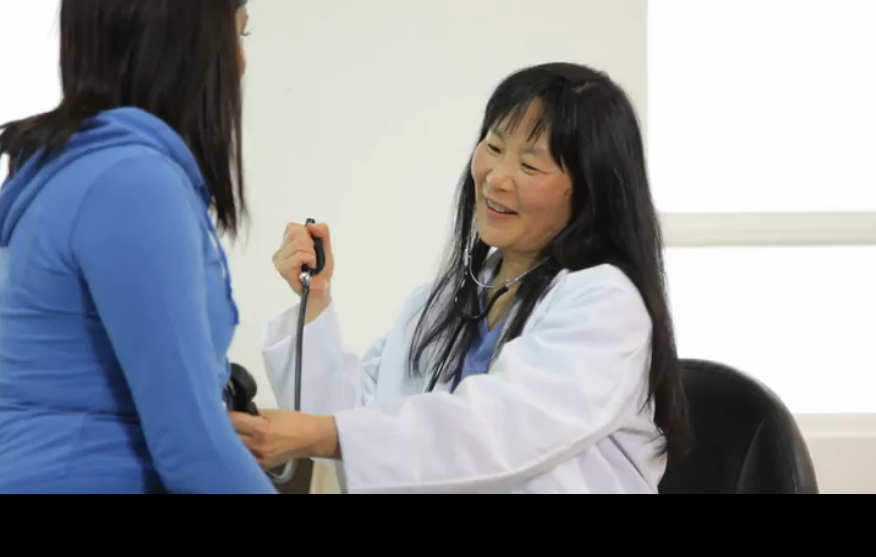
Where is `chair`? The height and width of the screenshot is (557, 876). chair is located at coordinates (738, 454).